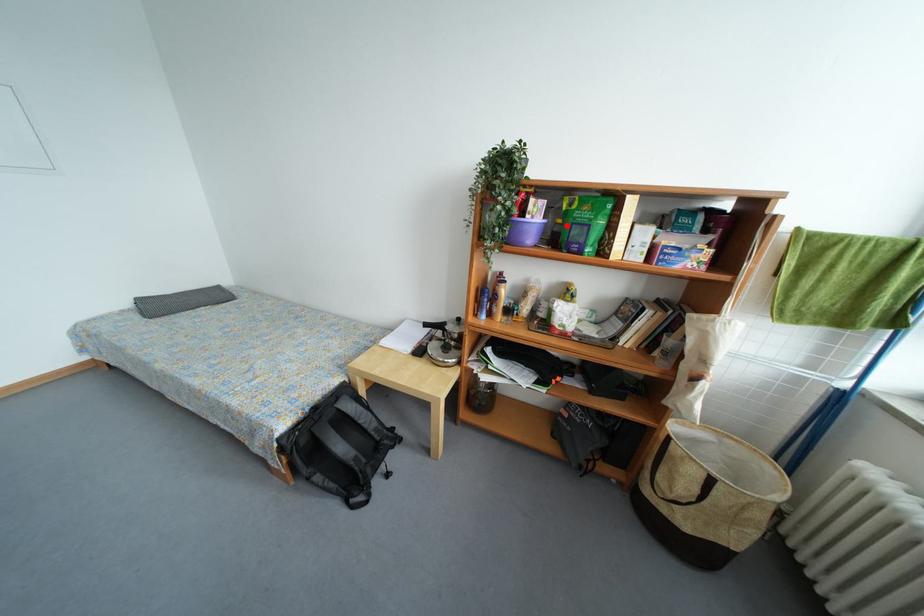
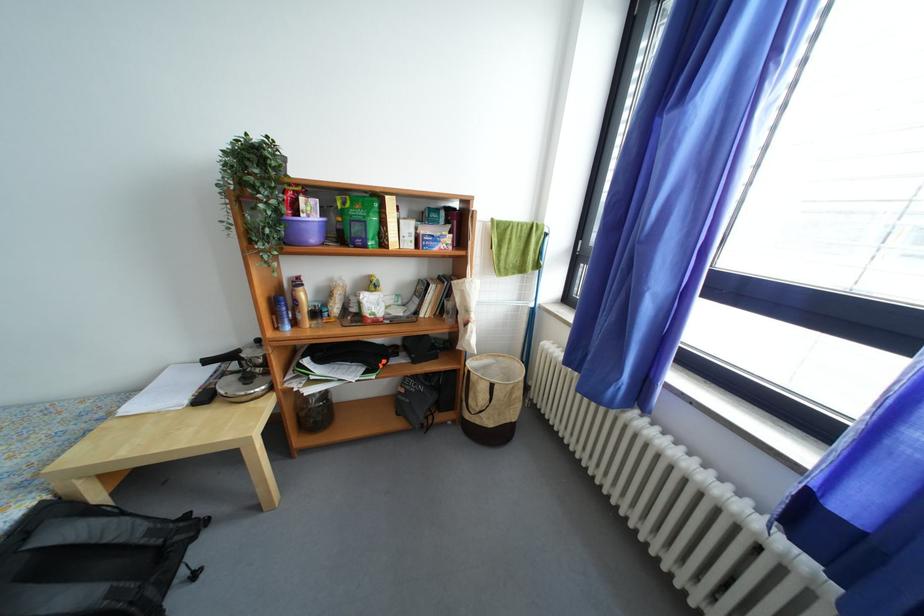
The point at the highlighted location is marked in the first image. Where is the corresponding point in the second image?

(346, 224)